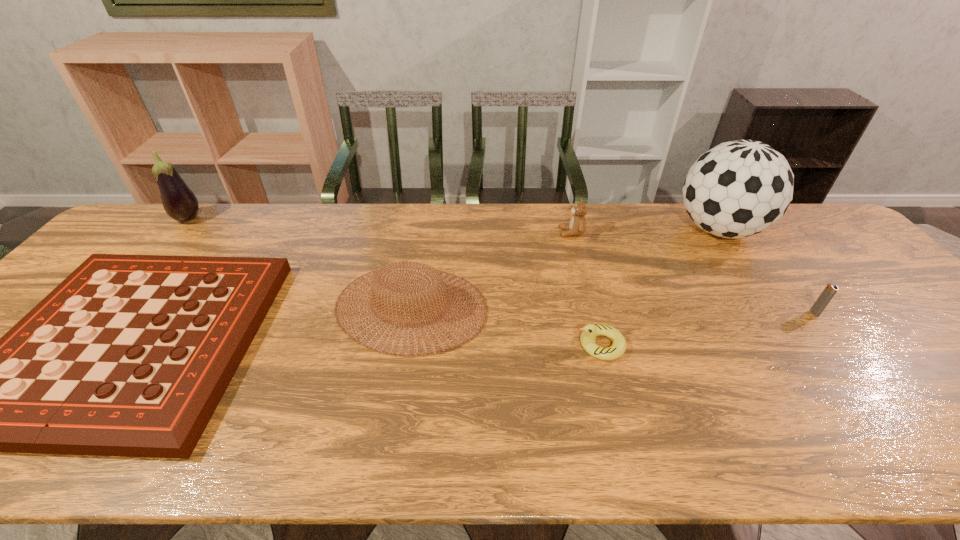
Locate an element on the screen. object that is at the far left corner is located at coordinates (180, 203).

Where is `free space at the far edge of the desktop`? free space at the far edge of the desktop is located at coordinates (306, 207).

I want to click on vacant space at the near edge of the desktop, so click(x=415, y=423).

In the image, there is a desktop. What are the coordinates of `free region at the right edge` in the screenshot? It's located at (930, 353).

Locate an element on the screen. The width and height of the screenshot is (960, 540). free space at the far left corner of the desktop is located at coordinates (132, 239).

Locate an element on the screen. This screenshot has width=960, height=540. unoccupied area between the teddy bear and the sunhat is located at coordinates (492, 271).

The width and height of the screenshot is (960, 540). What are the coordinates of `vacant space that is in between the fifth object from right to left and the duckling` in the screenshot? It's located at (506, 326).

You are a GUI agent. You are given a task and a screenshot of the screen. Output one action in this format:
    pyautogui.click(x=<x>, y=<y>)
    Task: Click on the free point between the tallest object and the fifth object from right to left
    The width and height of the screenshot is (960, 540).
    Given the screenshot: What is the action you would take?
    pyautogui.click(x=564, y=269)

You are a GUI agent. You are given a task and a screenshot of the screen. Output one action in this format:
    pyautogui.click(x=<x>, y=<y>)
    Task: Click on the empty location between the eggplant and the igniter
    The image size is (960, 540).
    Given the screenshot: What is the action you would take?
    pyautogui.click(x=501, y=266)

What are the coordinates of `unoccupied position between the sunhat and the teddy bear` in the screenshot? It's located at (492, 271).